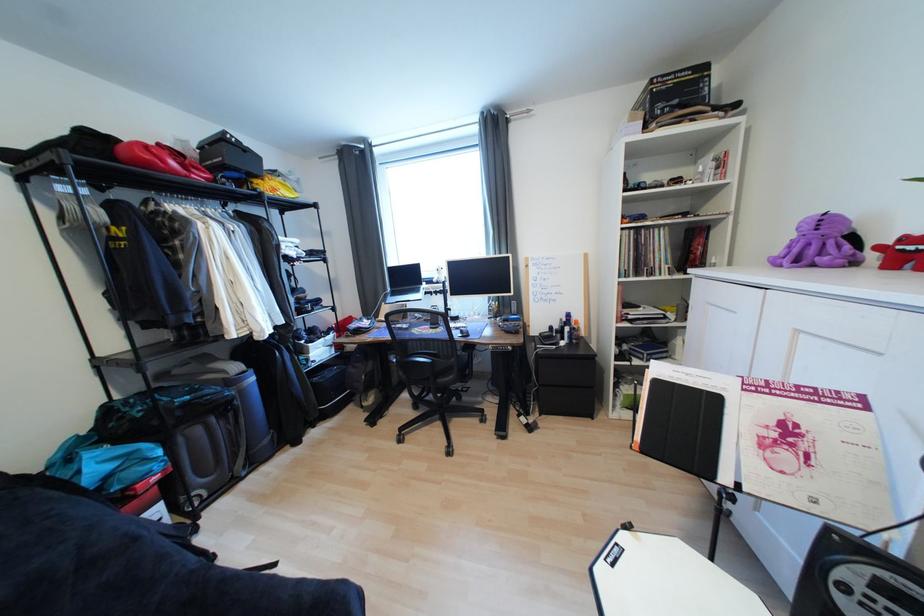
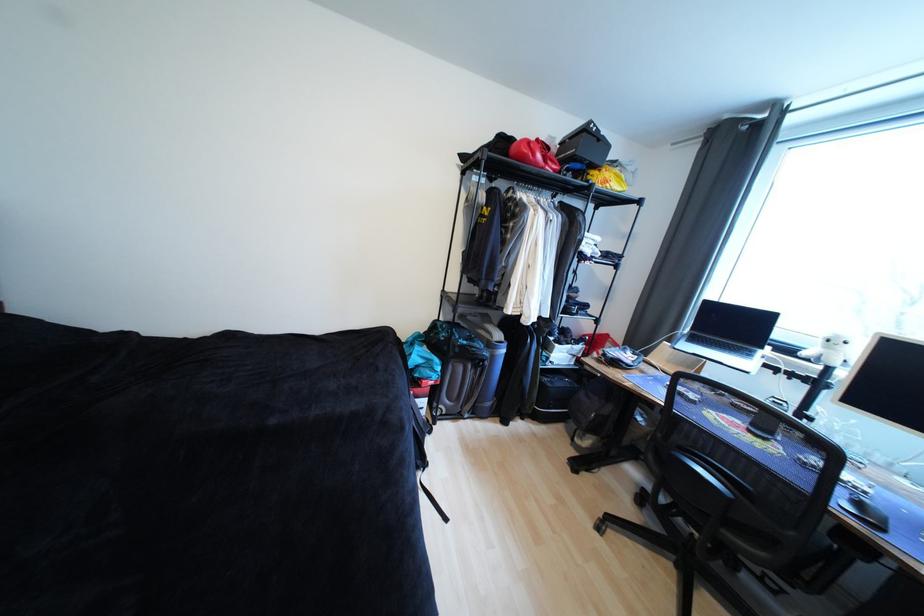
In the second image, find the point that corresponds to point (444, 284) in the first image.

(812, 361)